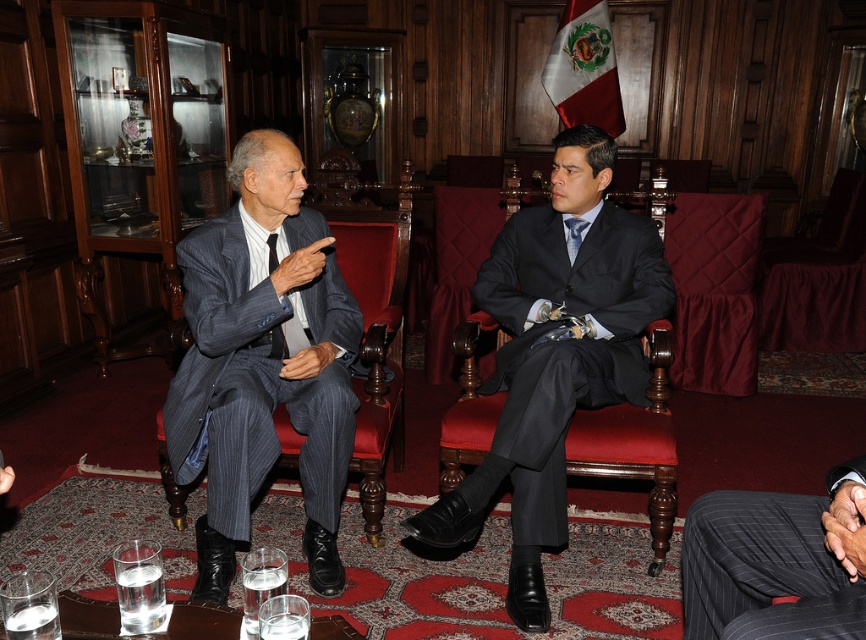
Question: Among these points, which one is nearest to the camera?

Choices:
 (A) (278, 349)
 (B) (712, 536)

Answer: (B)

Question: Can you confirm if pinstriped fabric suit at center is thinner than blue silk tie at center?

Choices:
 (A) yes
 (B) no

Answer: (B)

Question: Estimate the real-world distances between objects in this image. Which object is closer to the matte black suit at center?

Choices:
 (A) matte black tie at upper left
 (B) pinstriped fabric suit at center
 (C) blue silk tie at center

Answer: (C)

Question: Can you confirm if pinstriped fabric suit at center is positioned to the right of blue silk tie at center?

Choices:
 (A) yes
 (B) no

Answer: (A)

Question: In this image, where is matte black suit at center located relative to pinstriped fabric suit at center?

Choices:
 (A) right
 (B) left

Answer: (B)

Question: Among these points, which one is farthest from the camera?

Choices:
 (A) (541, 440)
 (B) (313, 291)
 (C) (275, 246)
 (D) (577, 218)

Answer: (D)